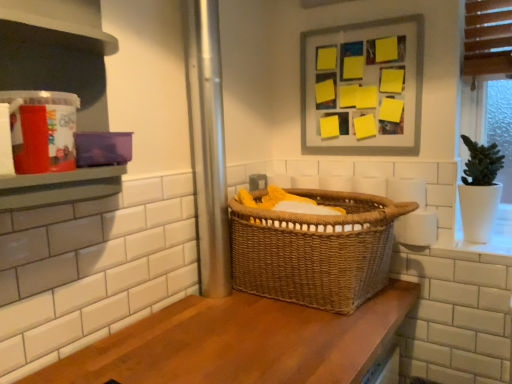
Question: Looking at the image, does white matte toilet paper at right, positioned as the 2th toilet paper in top-to-bottom order, seem bigger or smaller compared to wooden counter at center?

Choices:
 (A) small
 (B) big

Answer: (A)

Question: From a real-world perspective, is white matte toilet paper at right, positioned as the 2th toilet paper in top-to-bottom order, positioned above or below wooden counter at center?

Choices:
 (A) above
 (B) below

Answer: (A)

Question: Estimate the real-world distances between objects in this image. Which object is farther from the white matte toilet paper at right, positioned as the 2th toilet paper in top-to-bottom order?

Choices:
 (A) yellow paper at upper center
 (B) woven brown basket at center
 (C) white matte toilet paper at right, positioned as the 2th toilet paper in bottom-to-top order
 (D) matte plastic container at left
 (E) wooden counter at center

Answer: (D)

Question: Estimate the real-world distances between objects in this image. Which object is farther from the yellow paper at upper center?

Choices:
 (A) white matte toilet paper at right, which appears as the 1th toilet paper when ordered from the bottom
 (B) white matte toilet paper at right, which is the first toilet paper in top-to-bottom order
 (C) matte plastic container at left
 (D) woven brown basket at center
 (E) wooden counter at center

Answer: (C)